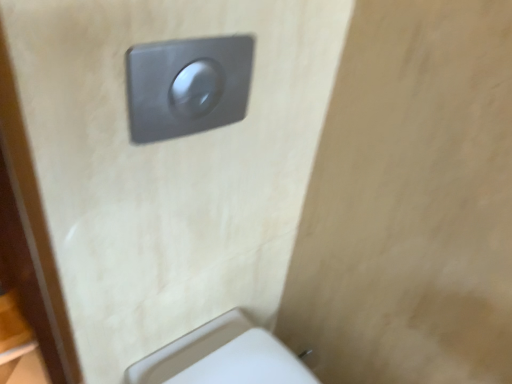
Question: Is satin silver switch at upper center completely or partially inside metallic gray flush button at upper center?

Choices:
 (A) no
 (B) yes

Answer: (A)

Question: Is metallic gray flush button at upper center with satin silver switch at upper center?

Choices:
 (A) no
 (B) yes

Answer: (A)

Question: From a real-world perspective, is metallic gray flush button at upper center located higher than satin silver switch at upper center?

Choices:
 (A) no
 (B) yes

Answer: (A)

Question: Can you confirm if metallic gray flush button at upper center is positioned to the left of satin silver switch at upper center?

Choices:
 (A) no
 (B) yes

Answer: (B)

Question: Considering the relative sizes of metallic gray flush button at upper center and satin silver switch at upper center in the image provided, is metallic gray flush button at upper center thinner than satin silver switch at upper center?

Choices:
 (A) no
 (B) yes

Answer: (A)

Question: Considering the relative positions of metallic gray flush button at upper center and white plastic toilet at lower right in the image provided, is metallic gray flush button at upper center to the left or to the right of white plastic toilet at lower right?

Choices:
 (A) right
 (B) left

Answer: (B)

Question: In the image, is metallic gray flush button at upper center positioned in front of or behind white plastic toilet at lower right?

Choices:
 (A) behind
 (B) front

Answer: (B)

Question: From their relative heights in the image, would you say metallic gray flush button at upper center is taller or shorter than white plastic toilet at lower right?

Choices:
 (A) tall
 (B) short

Answer: (A)

Question: Considering the positions of metallic gray flush button at upper center and white plastic toilet at lower right in the image, is metallic gray flush button at upper center wider or thinner than white plastic toilet at lower right?

Choices:
 (A) wide
 (B) thin

Answer: (B)

Question: Is white plastic toilet at lower right spatially inside satin silver switch at upper center, or outside of it?

Choices:
 (A) inside
 (B) outside

Answer: (B)

Question: Is point (216, 332) positioned closer to the camera than point (181, 114)?

Choices:
 (A) farther
 (B) closer

Answer: (A)

Question: Relative to satin silver switch at upper center, is white plastic toilet at lower right in front or behind?

Choices:
 (A) front
 (B) behind

Answer: (B)

Question: Is white plastic toilet at lower right wider or thinner than satin silver switch at upper center?

Choices:
 (A) wide
 (B) thin

Answer: (A)

Question: Choose the correct answer: Is satin silver switch at upper center inside metallic gray flush button at upper center or outside it?

Choices:
 (A) inside
 (B) outside

Answer: (B)

Question: Considering the relative positions of satin silver switch at upper center and metallic gray flush button at upper center in the image provided, is satin silver switch at upper center to the left or to the right of metallic gray flush button at upper center?

Choices:
 (A) left
 (B) right

Answer: (B)